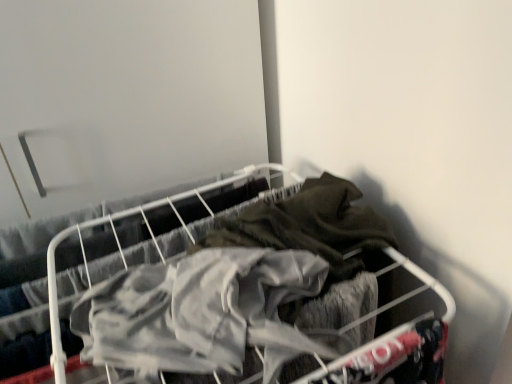
Measure the distance between white wire laundry basket at center and camera.

white wire laundry basket at center and camera are 19.54 inches apart.

Locate an element on the screen. The width and height of the screenshot is (512, 384). white wire laundry basket at center is located at coordinates (253, 299).

Describe the element at coordinates (253, 299) in the screenshot. Image resolution: width=512 pixels, height=384 pixels. I see `white wire laundry basket at center` at that location.

The height and width of the screenshot is (384, 512). Identify the location of white wire laundry basket at center. (253, 299).